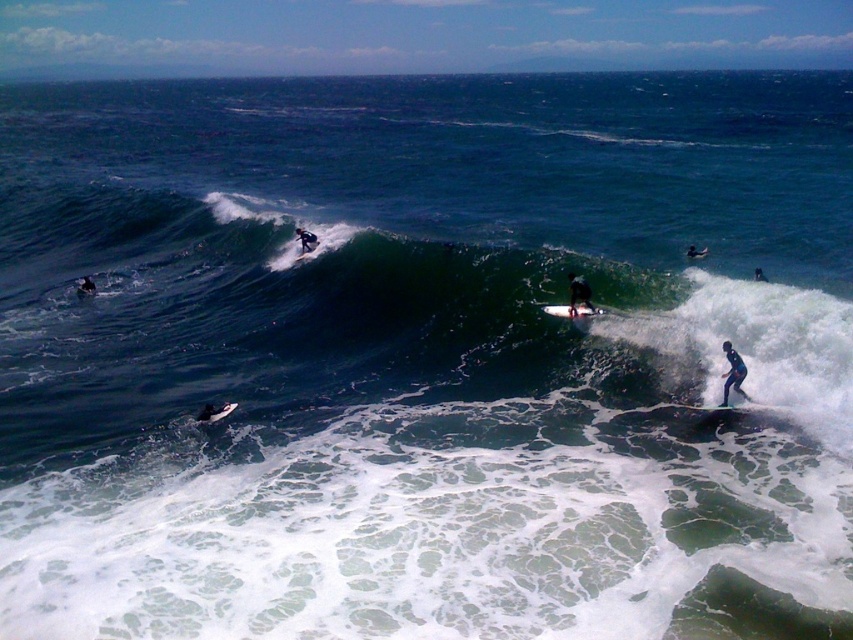
Who is more distant from viewer, (723,372) or (759,273)?

Positioned behind is point (759,273).

Describe the element at coordinates (732, 371) in the screenshot. I see `black matte wetsuit at lower right` at that location.

This screenshot has height=640, width=853. What do you see at coordinates (732, 371) in the screenshot?
I see `black matte wetsuit at lower right` at bounding box center [732, 371].

You are a GUI agent. You are given a task and a screenshot of the screen. Output one action in this format:
    pyautogui.click(x=<x>, y=<y>)
    Task: Click on the black matte wetsuit at lower right
    
    Given the screenshot: What is the action you would take?
    pyautogui.click(x=732, y=371)

Can you confirm if white foam surfboard at center is bigger than dark blue wetsuit at center?

No, white foam surfboard at center is not bigger than dark blue wetsuit at center.

Does white foam surfboard at center appear on the right side of dark blue wetsuit at center?

Indeed, white foam surfboard at center is positioned on the right side of dark blue wetsuit at center.

Locate an element on the screen. The image size is (853, 640). white foam surfboard at center is located at coordinates (572, 310).

Between point (83, 276) and point (758, 275), which one is positioned in front?

Positioned in front is point (758, 275).

Who is positioned more to the right, black matte surfboard at lower left or dark blue wetsuit at right?

From the viewer's perspective, dark blue wetsuit at right appears more on the right side.

The height and width of the screenshot is (640, 853). Find the location of `black matte surfboard at lower left`. black matte surfboard at lower left is located at coordinates (86, 285).